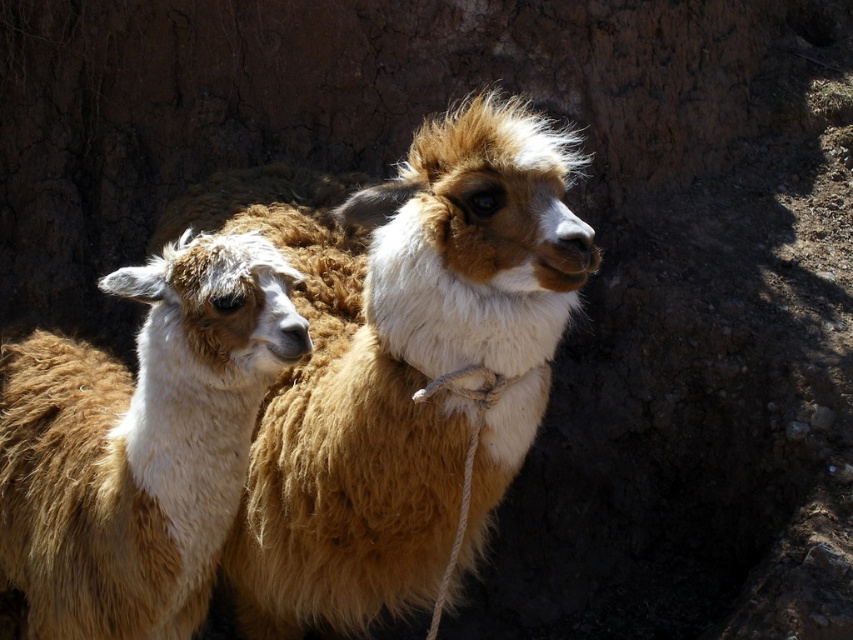
Identify the location of fuzzy brown alpaca at center. (397, 360).

Is fuzzy brown alpaca at center thinner than brown woolen alpaca at left?

No.

Does point (492, 108) come behind point (44, 636)?

That is False.

Locate an element on the screen. The width and height of the screenshot is (853, 640). fuzzy brown alpaca at center is located at coordinates (397, 360).